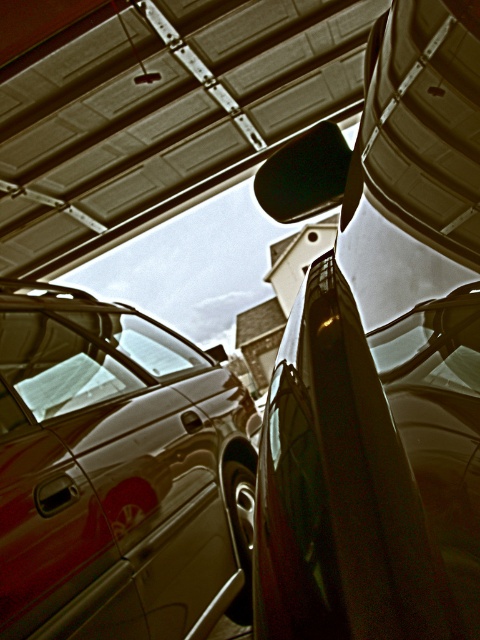
Question: Considering the relative positions of glossy metallic car at upper right and shiny metallic van at lower left in the image provided, where is glossy metallic car at upper right located with respect to shiny metallic van at lower left?

Choices:
 (A) above
 (B) below

Answer: (A)

Question: Is glossy metallic car at upper right to the left of shiny metallic van at lower left from the viewer's perspective?

Choices:
 (A) no
 (B) yes

Answer: (A)

Question: Is glossy metallic car at upper right smaller than shiny metallic van at lower left?

Choices:
 (A) no
 (B) yes

Answer: (B)

Question: Among these points, which one is farthest from the camera?

Choices:
 (A) (424, 266)
 (B) (183, 356)

Answer: (B)

Question: Which of the following is the closest to the observer?

Choices:
 (A) glossy metallic car at upper right
 (B) shiny metallic van at lower left

Answer: (A)